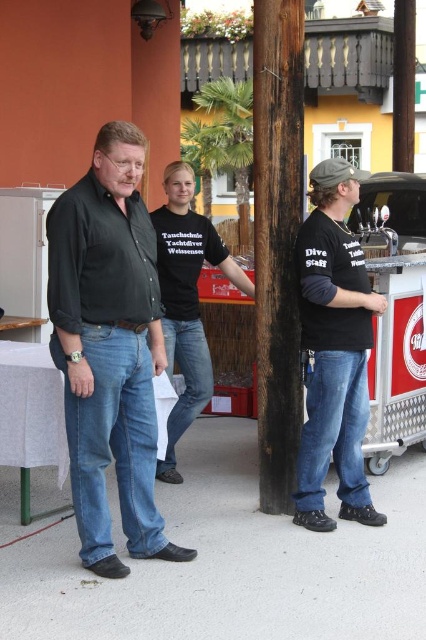
You are a photographer trying to capture a group photo of the matte black shirt at center and the dark brown wood pole at center. The camera you are using has a maximum width capacity of 1.2 meters. Can both subjects fit within the camera frame if positioned side by side?

The matte black shirt at center is wider than the dark brown wood pole at center. Since the total width of both subjects combined would exceed the camera frame of 1.2 meters, they might not fit together. However, without exact measurements, this is an estimate based on their relative sizes.